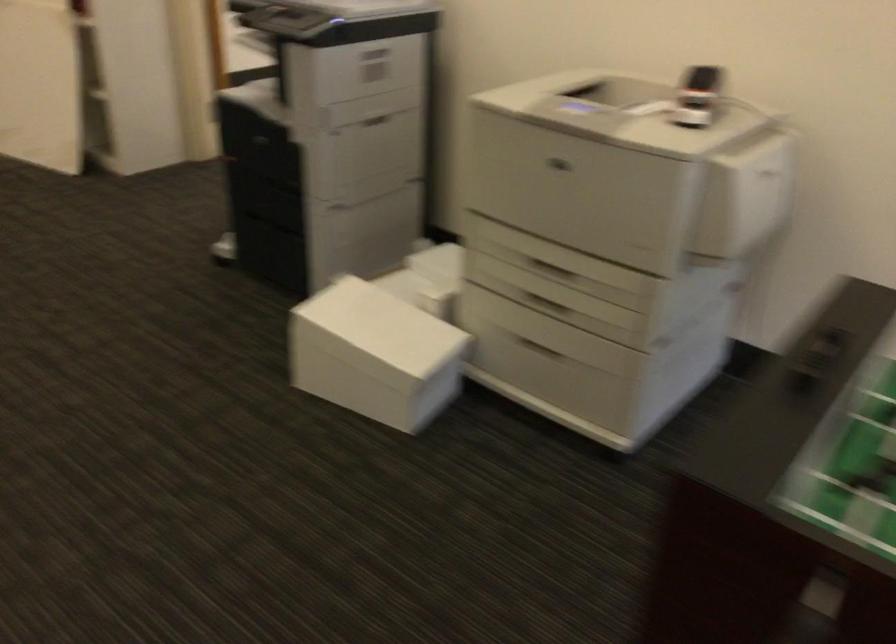
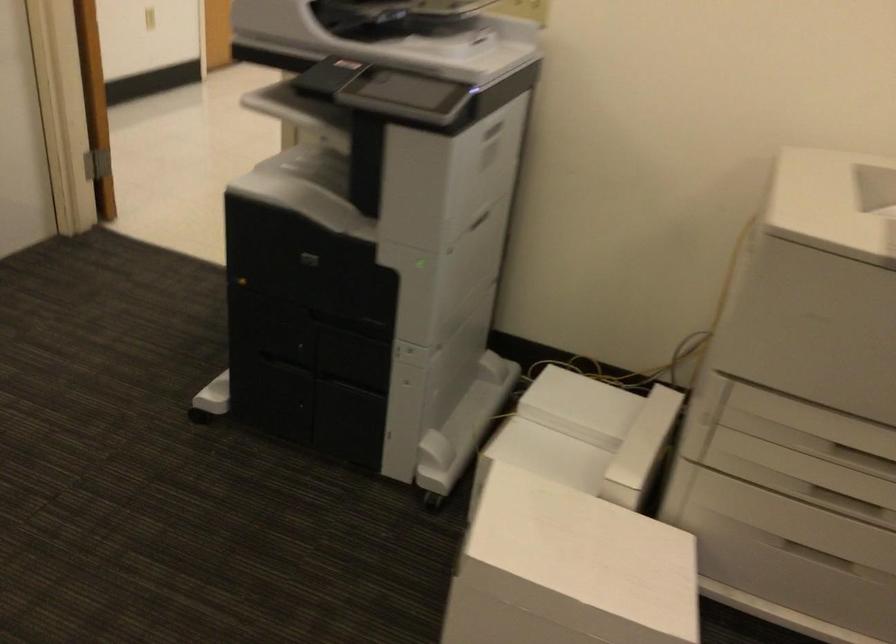
What movement of the cameraman would produce the second image?

The cameraman walked toward left, forward.